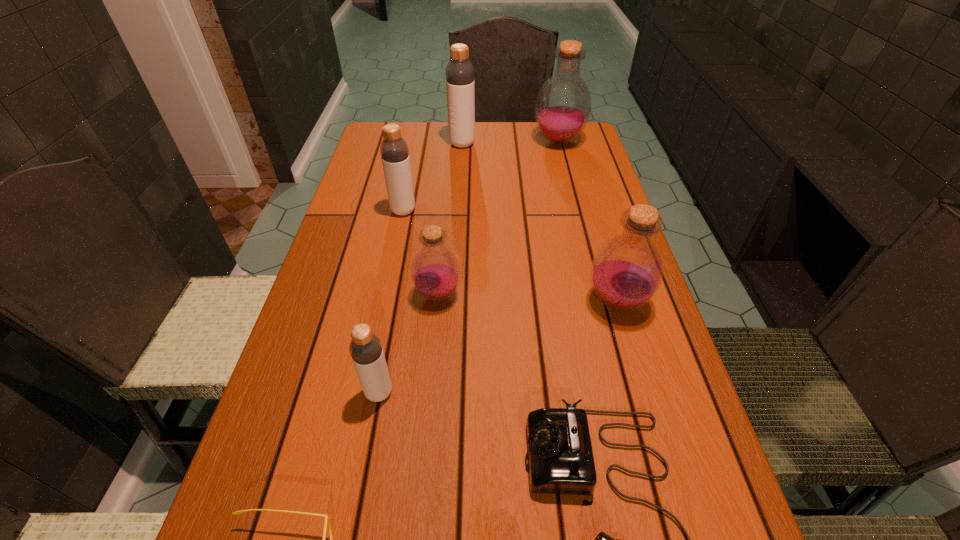
You are a GUI agent. You are given a task and a screenshot of the screen. Output one action in this format:
    pyautogui.click(x=<x>, y=<y>)
    Task: Click on the biggest gray bottle
    The height and width of the screenshot is (540, 960).
    Given the screenshot: What is the action you would take?
    pyautogui.click(x=460, y=85)

Find the location of a particular element. This screenshot has height=540, width=960. the farthest gray bottle is located at coordinates (460, 85).

Locate an element on the screen. the farthest purple bottle is located at coordinates (563, 105).

This screenshot has width=960, height=540. What are the coordinates of `the second smallest purple bottle` in the screenshot? It's located at (626, 272).

Find the location of a particular element. the third farthest bottle is located at coordinates (394, 151).

Where is `the second smallest gray bottle`? The width and height of the screenshot is (960, 540). the second smallest gray bottle is located at coordinates (394, 151).

In order to click on the third nearest object in this screenshot , I will do [x=366, y=350].

This screenshot has height=540, width=960. What are the coordinates of `the nearest bottle` in the screenshot? It's located at (366, 350).

Where is `the smallest purple bottle`? The height and width of the screenshot is (540, 960). the smallest purple bottle is located at coordinates (435, 271).

Find the location of `vacant space situated 0.300m on the right of the biggest gray bottle`. vacant space situated 0.300m on the right of the biggest gray bottle is located at coordinates (567, 144).